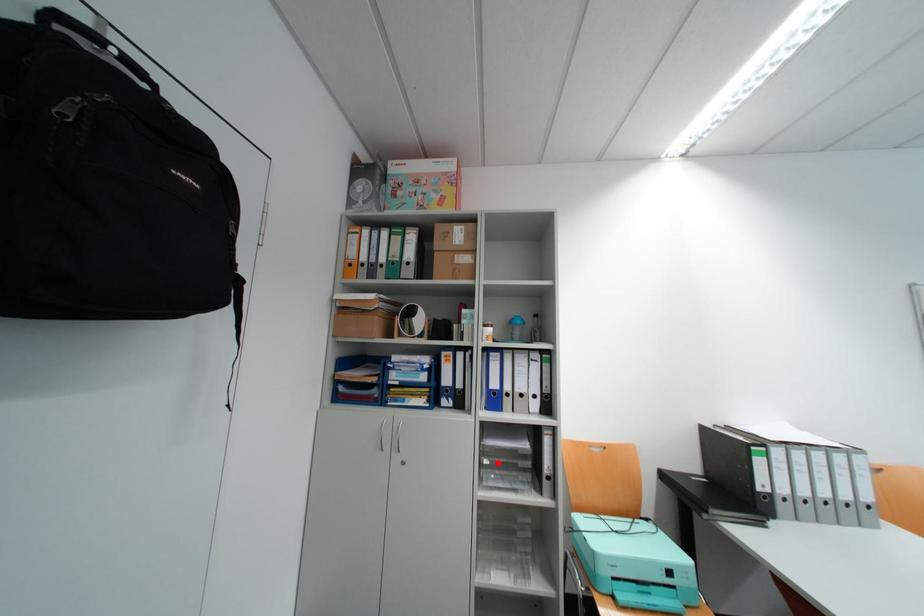
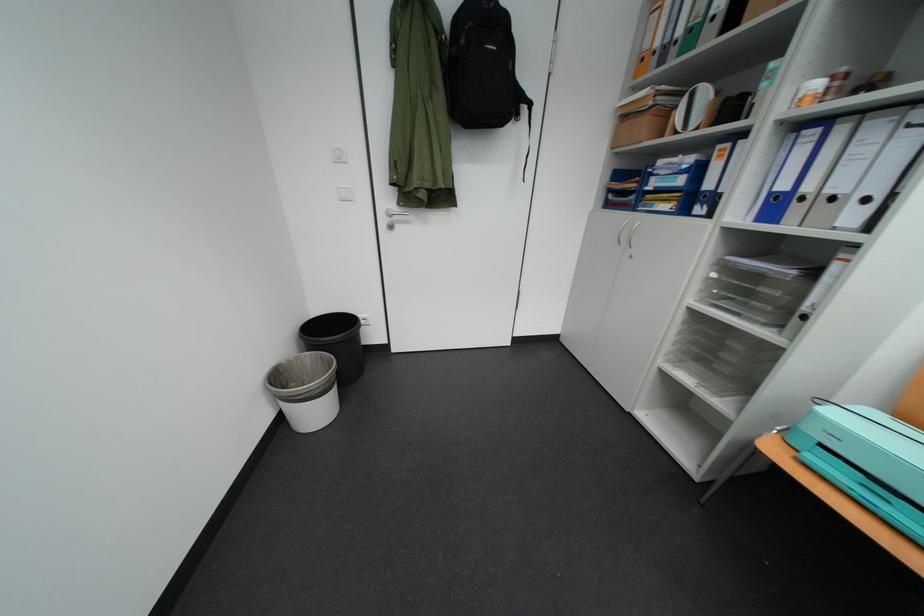
Question: I am providing you with two images of the same scene from different viewpoints. A red point is marked on the first image. Is the red point's position out of view in image 2?

Choices:
 (A) Yes
 (B) No

Answer: (B)